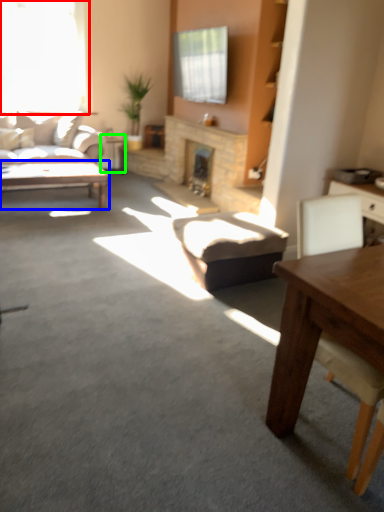
Question: Which is farther away from window (highlighted by a red box)? coffee table (highlighted by a blue box) or side table (highlighted by a green box)?

Choices:
 (A) coffee table
 (B) side table

Answer: (A)